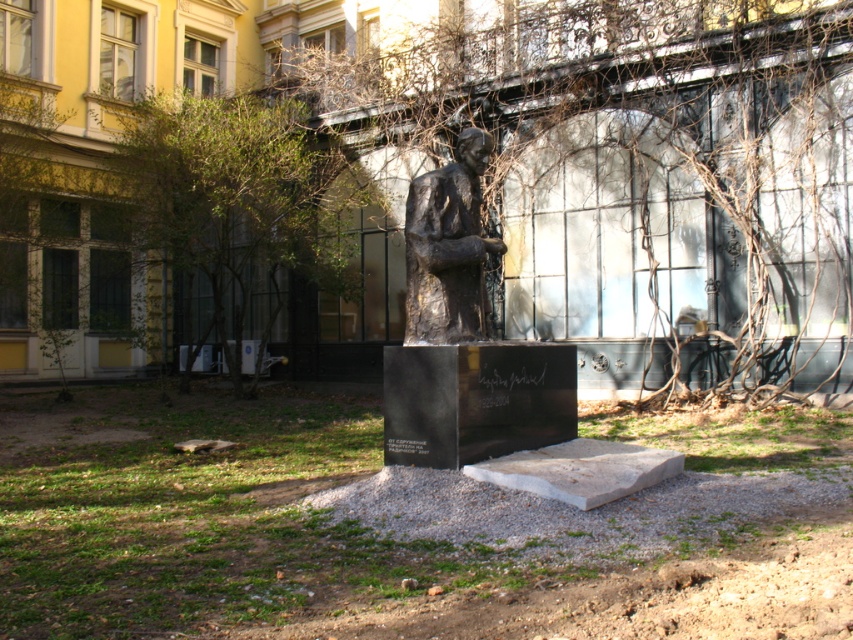
Question: Among these objects, which one is nearest to the camera?

Choices:
 (A) green leafy tree at upper left
 (B) bronze statue at center
 (C) brown leafless branches at center

Answer: (B)

Question: Estimate the real-world distances between objects in this image. Which object is closer to the brown leafless branches at center?

Choices:
 (A) green leafy tree at upper left
 (B) bronze statue at center

Answer: (B)

Question: Does brown leafless branches at center lie behind green leafy tree at upper left?

Choices:
 (A) no
 (B) yes

Answer: (A)

Question: Is brown leafless branches at center to the right of bronze statue at center from the viewer's perspective?

Choices:
 (A) yes
 (B) no

Answer: (B)

Question: Does green leafy tree at upper left appear on the left side of bronze statue at center?

Choices:
 (A) no
 (B) yes

Answer: (B)

Question: Which point is closer to the camera?

Choices:
 (A) (793, 77)
 (B) (436, 260)

Answer: (B)